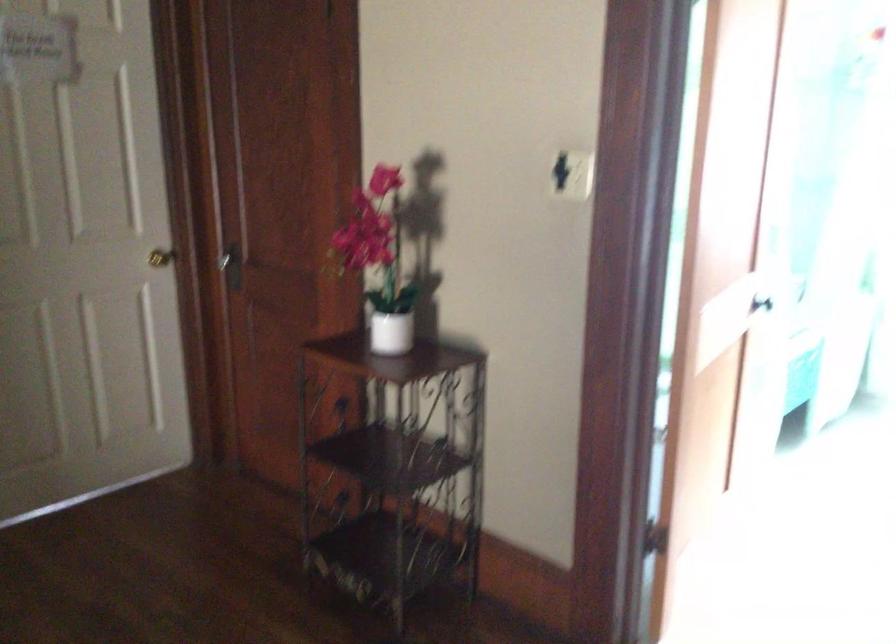
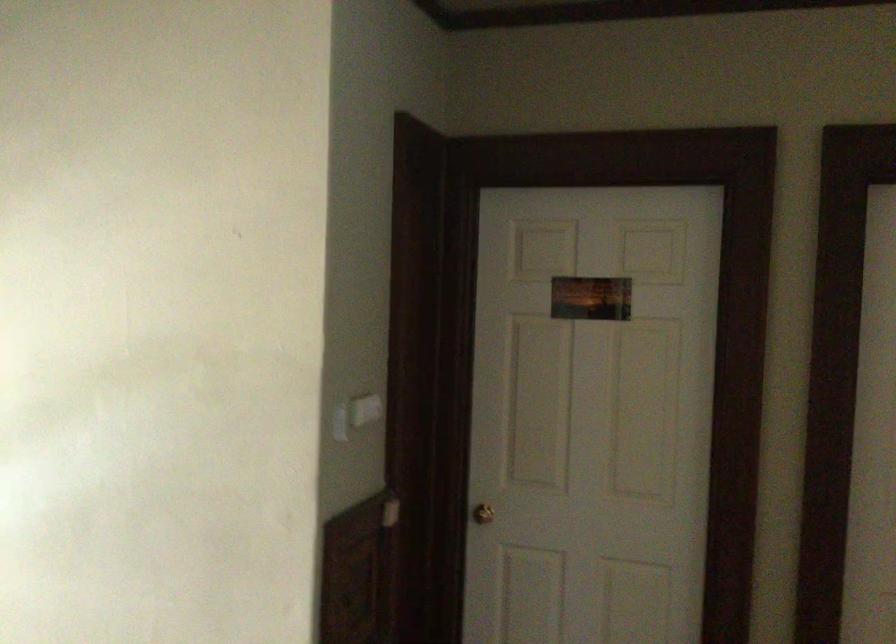
Question: Based on the continuous images, in which direction is the camera rotating? Reply with the corresponding letter.

Choices:
 (A) Left
 (B) Right
 (C) Up
 (D) Down

Answer: (A)